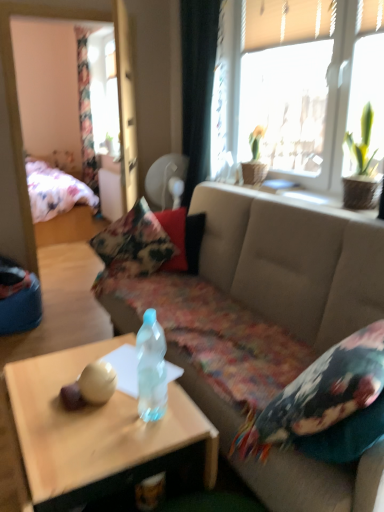
Question: From a real-world perspective, does translucent plastic coffee table at center stand above floral fabric pillow at center, marked as the 1th pillow in a back-to-front arrangement?

Choices:
 (A) yes
 (B) no

Answer: (B)

Question: Can you confirm if translucent plastic coffee table at center is bigger than floral fabric pillow at center, positioned as the 1th pillow in left-to-right order?

Choices:
 (A) no
 (B) yes

Answer: (B)

Question: Would you say floral fabric pillow at center, positioned as the 1th pillow in left-to-right order, is part of translucent plastic coffee table at center's contents?

Choices:
 (A) no
 (B) yes

Answer: (A)

Question: Is translucent plastic coffee table at center far away from floral fabric pillow at center, marked as the 1th pillow in a back-to-front arrangement?

Choices:
 (A) yes
 (B) no

Answer: (A)

Question: Is translucent plastic coffee table at center at the left side of floral fabric pillow at center, positioned as the second pillow in front-to-back order?

Choices:
 (A) no
 (B) yes

Answer: (A)

Question: From the image's perspective, relative to translucent plastic coffee table at center, is black fabric curtain at upper center, the second curtain viewed from the left, above or below?

Choices:
 (A) above
 (B) below

Answer: (A)

Question: Looking at the image, does black fabric curtain at upper center, which is the first curtain in right-to-left order, seem bigger or smaller compared to translucent plastic coffee table at center?

Choices:
 (A) big
 (B) small

Answer: (A)

Question: From a real-world perspective, is black fabric curtain at upper center, which appears as the 2th curtain when viewed from the back, above or below translucent plastic coffee table at center?

Choices:
 (A) below
 (B) above

Answer: (B)

Question: Considering the positions of point (205, 53) and point (49, 362), is point (205, 53) closer or farther from the camera than point (49, 362)?

Choices:
 (A) closer
 (B) farther

Answer: (B)

Question: In terms of size, does black fabric curtain at upper center, which appears as the 2th curtain when viewed from the back, appear bigger or smaller than translucent plastic bottle at center?

Choices:
 (A) small
 (B) big

Answer: (B)

Question: Is black fabric curtain at upper center, the second curtain viewed from the left, wider or thinner than translucent plastic bottle at center?

Choices:
 (A) thin
 (B) wide

Answer: (B)

Question: Considering their positions, is black fabric curtain at upper center, which appears as the 2th curtain when viewed from the back, located in front of or behind translucent plastic bottle at center?

Choices:
 (A) behind
 (B) front

Answer: (A)

Question: Is point (188, 190) closer or farther from the camera than point (150, 394)?

Choices:
 (A) farther
 (B) closer

Answer: (A)

Question: In the image, is black fabric curtain at upper center, which appears as the 2th curtain when viewed from the back, positioned in front of or behind floral fabric curtain at left, the first curtain in the left-to-right sequence?

Choices:
 (A) behind
 (B) front

Answer: (B)

Question: In terms of size, does black fabric curtain at upper center, which appears as the 2th curtain when viewed from the back, appear bigger or smaller than floral fabric curtain at left, arranged as the 1th curtain when viewed from the back?

Choices:
 (A) small
 (B) big

Answer: (A)